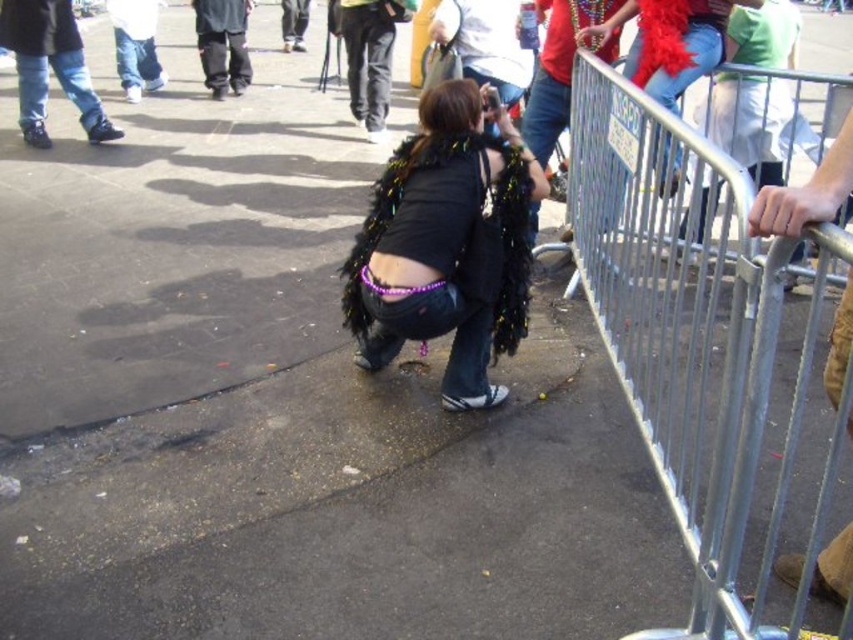
You are holding a 12 inch long measuring tape and want to measure the distance between the silver metallic rail at right and the camera. Can you do it with just the tape?

The silver metallic rail at right is 35.72 inches away from camera. Since the tape is only 12 inches long, it is not long enough to measure the distance between the silver metallic rail at right and the camera.

You are a performer preparing to move your black sequined feather boa at center to the silver metallic rail at right. Considering their widths, will the boa fit on the rail?

The silver metallic rail at right might be wider than black sequined feather boa at center, so there is a possibility that the boa will fit on the rail.